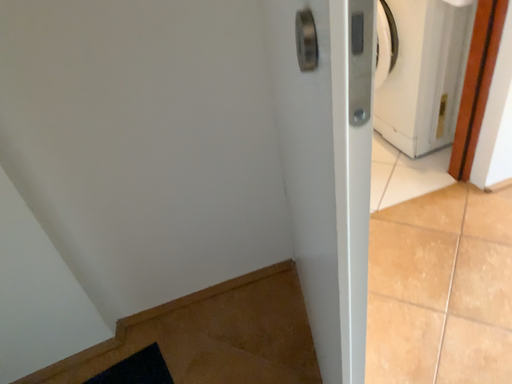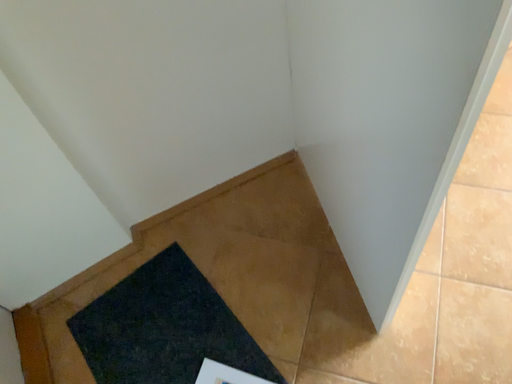
Question: How did the camera likely rotate when shooting the video?

Choices:
 (A) rotated upward
 (B) rotated downward

Answer: (B)